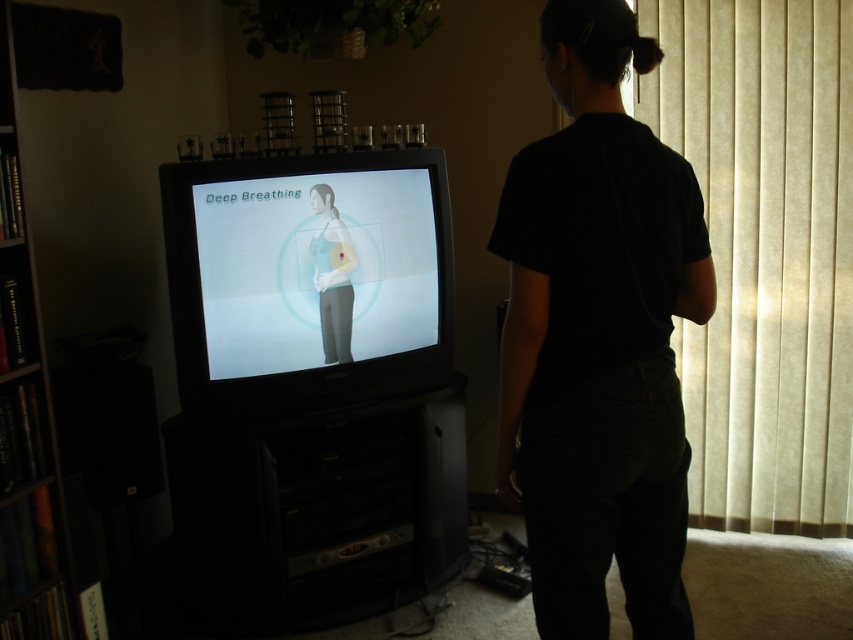
Based on the scene description, where is the beige fabric curtain at right located in the room?

The beige fabric curtain at right is located at the right side of the room near the window, as indicated by its 2D coordinates at point (x=764, y=252).

You are a delivery person entering the room and need to place a package on the beige fabric curtain at right and the black plastic entertainment center at lower center. Which surface is closer to you?

The beige fabric curtain at right is closer to you because it is further to the viewer than the black plastic entertainment center at lower center, meaning it is nearer in proximity.

You are a delivery robot in the room. You need to deliver a package to the point at coordinates point (721, 445). However, there is an obstacle at point (318, 259). Can you go around the obstacle to reach your destination?

Point (721, 445) is behind point (318, 259), so yes, the robot can go around the obstacle at point (318, 259) to reach the destination at point (721, 445).